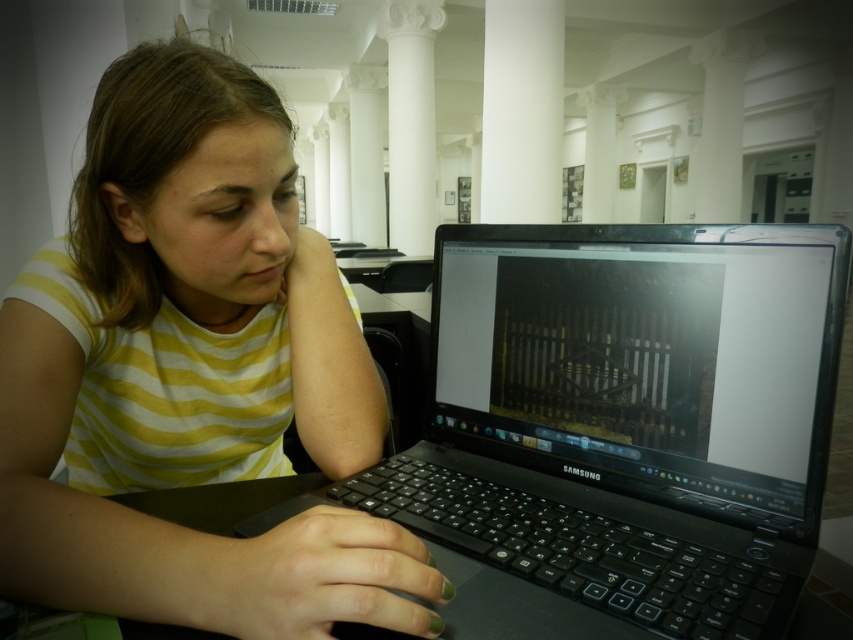
Does black plastic laptop at center appear on the right side of white smooth pillar at center?

In fact, black plastic laptop at center is to the left of white smooth pillar at center.

Between black plastic laptop at center and white smooth pillar at center, which one has less height?

black plastic laptop at center is shorter.

Is point (466, 392) in front of point (552, 124)?

Yes, it is.

You are a GUI agent. You are given a task and a screenshot of the screen. Output one action in this format:
    pyautogui.click(x=<x>, y=<y>)
    Task: Click on the black plastic laptop at center
    
    Given the screenshot: What is the action you would take?
    pyautogui.click(x=619, y=428)

Is black plastic laptop at center smaller than black plastic table at center?

No, black plastic laptop at center is not smaller than black plastic table at center.

Who is shorter, black plastic laptop at center or black plastic table at center?

black plastic table at center

Is point (375, 467) closer to viewer compared to point (209, 508)?

No, it is behind (209, 508).

Where is `black plastic laptop at center`? This screenshot has width=853, height=640. black plastic laptop at center is located at coordinates (619, 428).

Is the position of black plastic laptop at center less distant than that of white marble column at center?

Yes, it is.

Which of these two, black plastic laptop at center or white marble column at center, stands taller?

Standing taller between the two is white marble column at center.

Which is behind, point (641, 346) or point (402, 144)?

The point (402, 144) is more distant.

You are a GUI agent. You are given a task and a screenshot of the screen. Output one action in this format:
    pyautogui.click(x=<x>, y=<y>)
    Task: Click on the black plastic laptop at center
    The width and height of the screenshot is (853, 640).
    Given the screenshot: What is the action you would take?
    pyautogui.click(x=619, y=428)